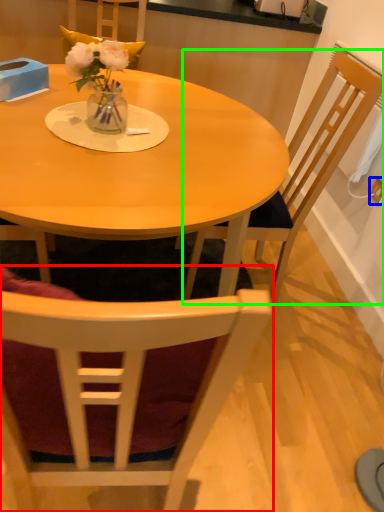
Question: Which is nearer to the chair (highlighted by a red box)? power outlet (highlighted by a blue box) or chair (highlighted by a green box).

Choices:
 (A) power outlet
 (B) chair

Answer: (B)